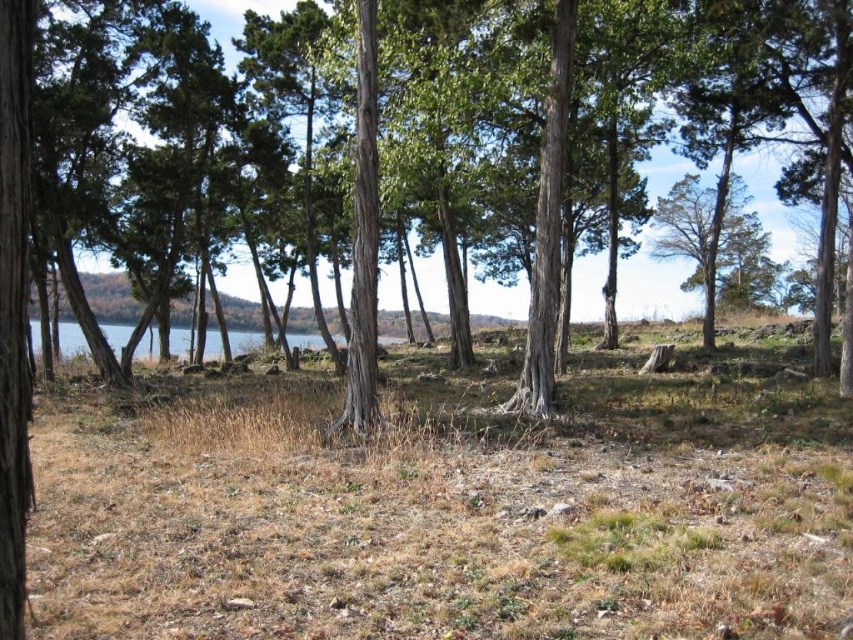
Question: Is brown dry grass at center smaller than smooth bark tree at center?

Choices:
 (A) no
 (B) yes

Answer: (B)

Question: Considering the relative positions of brown dry grass at center and smooth bark tree at center in the image provided, where is brown dry grass at center located with respect to smooth bark tree at center?

Choices:
 (A) above
 (B) below

Answer: (B)

Question: Is brown dry grass at center above smooth bark tree at center?

Choices:
 (A) yes
 (B) no

Answer: (B)

Question: Which point is closer to the camera?

Choices:
 (A) (178, 612)
 (B) (440, 150)

Answer: (A)

Question: Which of the following is the farthest from the observer?

Choices:
 (A) (457, 416)
 (B) (822, 275)

Answer: (B)